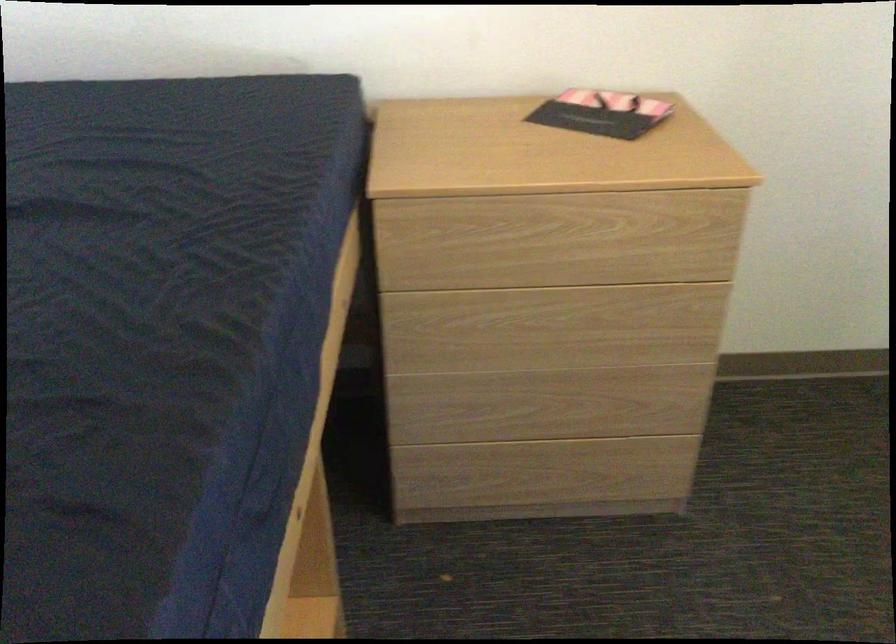
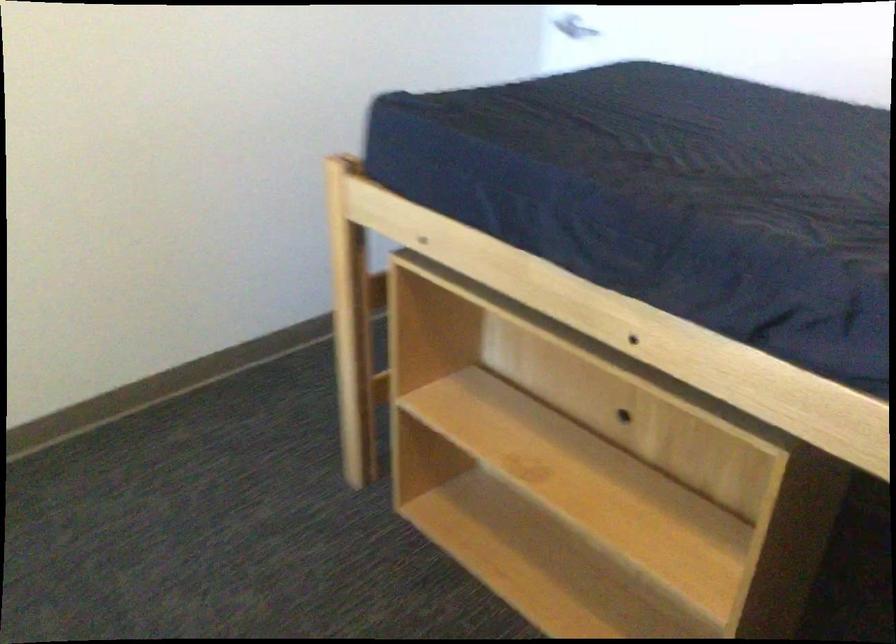
The point at [225,399] is marked in the first image. Where is the corresponding point in the second image?

(651, 193)